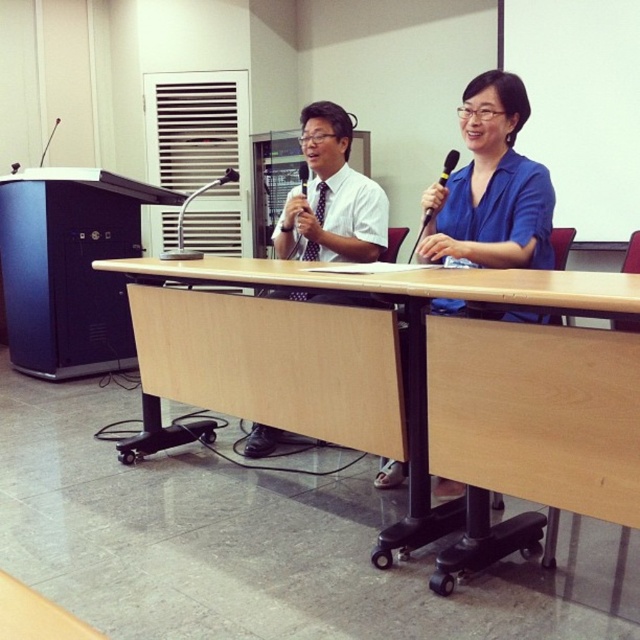
Question: Does black plastic microphone at upper center appear on the right side of black plastic microphone at center?

Choices:
 (A) yes
 (B) no

Answer: (A)

Question: Which object is positioned farthest from the blue matte shirt at center?

Choices:
 (A) black plastic microphone at center
 (B) light brown wood table at center
 (C) black plastic microphone at upper center

Answer: (A)

Question: Which object is farther from the camera taking this photo?

Choices:
 (A) blue matte shirt at center
 (B) light brown wood table at center
 (C) black plastic microphone at upper center
 (D) black plastic microphone at center

Answer: (D)

Question: Is light brown wood table at center to the left of black plastic microphone at center from the viewer's perspective?

Choices:
 (A) yes
 (B) no

Answer: (B)

Question: Among these points, which one is nearest to the camera?

Choices:
 (A) (420, 230)
 (B) (404, 456)

Answer: (B)

Question: Can you confirm if light brown wood table at center is positioned to the right of black plastic microphone at upper center?

Choices:
 (A) yes
 (B) no

Answer: (B)